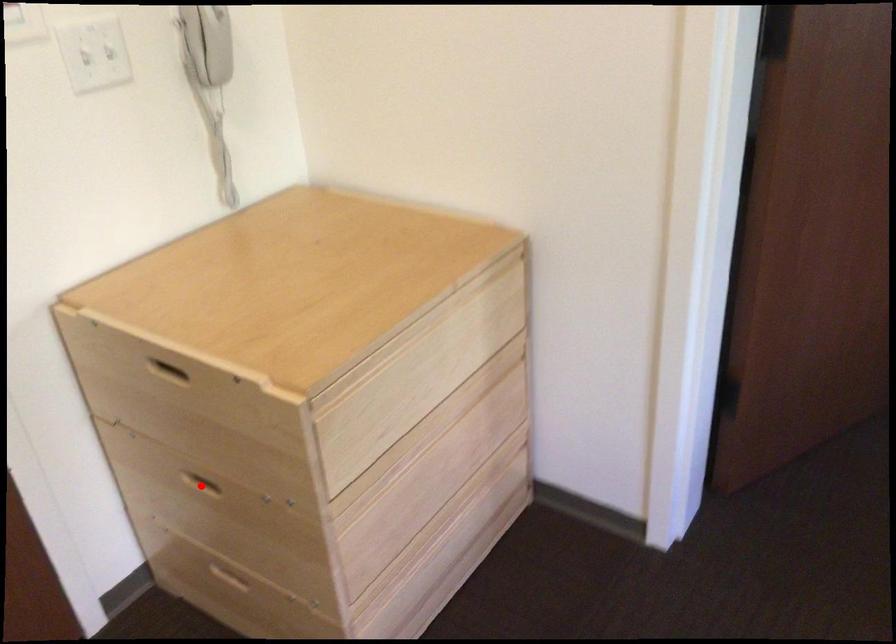
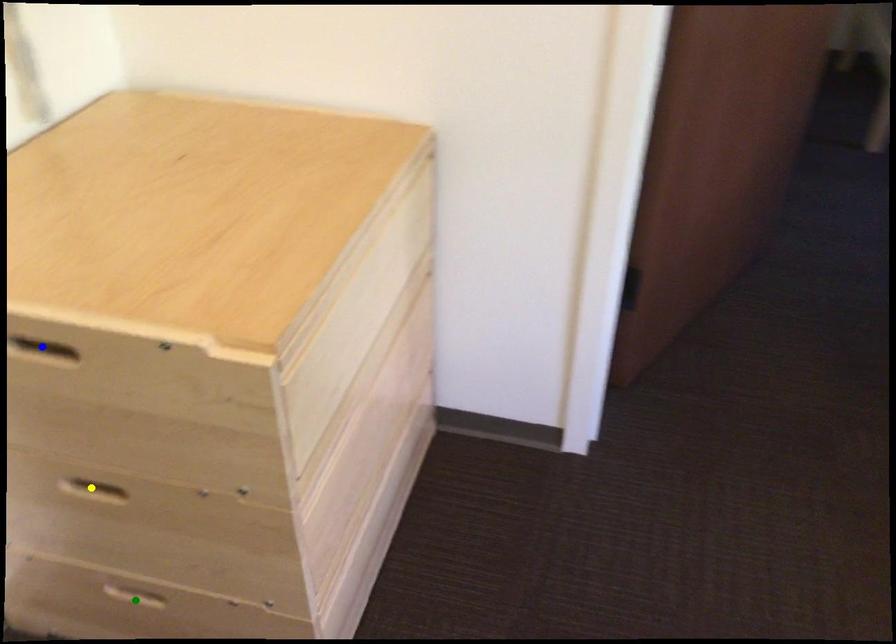
Question: I am providing you with two images of the same scene from different viewpoints. A red point is marked on the first image. You are given multiple points on the second image. Which point in image 2 represents the same 3d spot as the red point in image 1?

Choices:
 (A) green point
 (B) blue point
 (C) yellow point

Answer: (C)